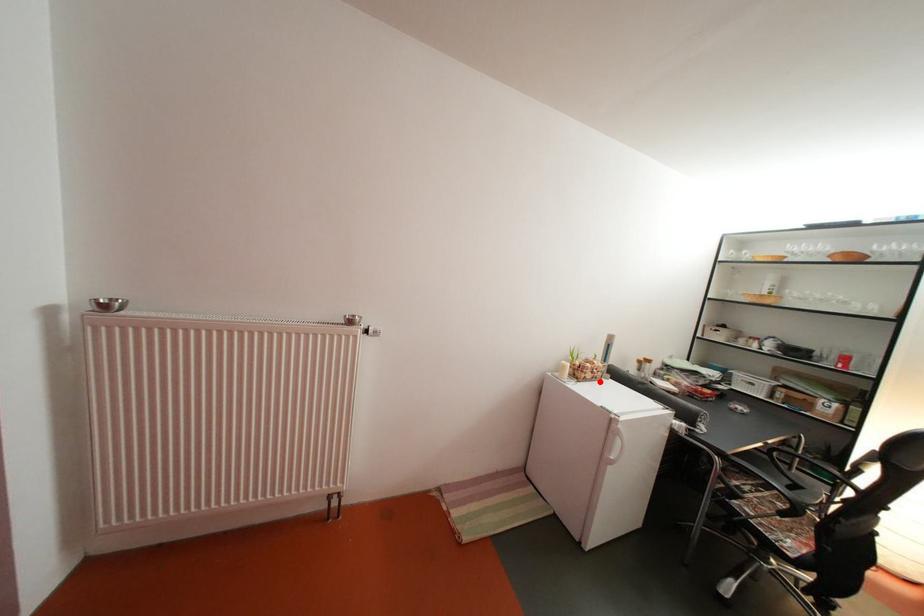
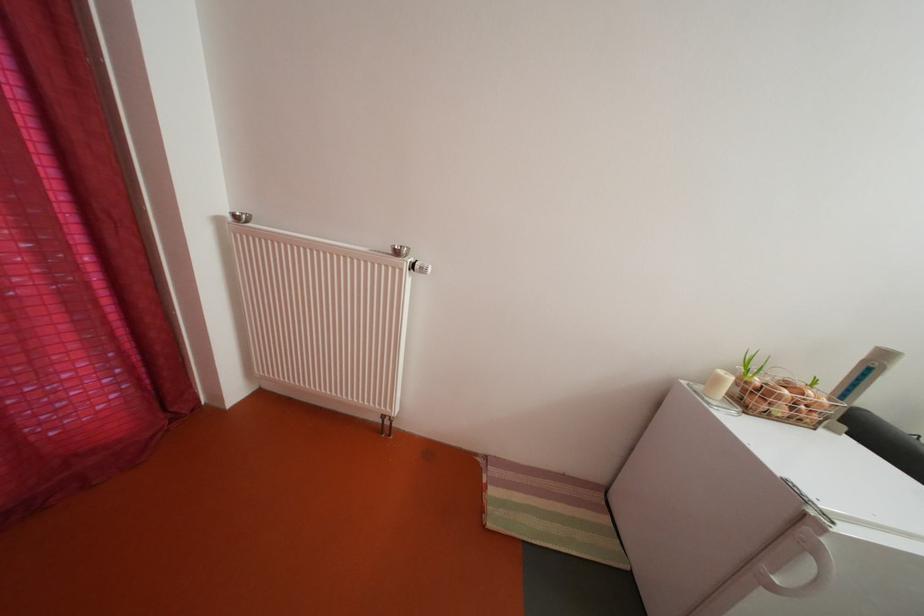
Question: I am providing you with two images of the same scene from different viewpoints. A red point is marked on the first image. At the location where the point appears in image 1, is it still visible in image 2?

Choices:
 (A) Yes
 (B) No

Answer: (A)